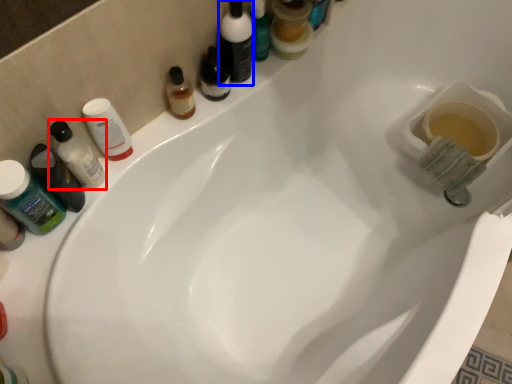
Question: Among these objects, which one is nearest to the camera, mouthwash (highlighted by a red box) or toiletry (highlighted by a blue box)?

Choices:
 (A) mouthwash
 (B) toiletry

Answer: (A)